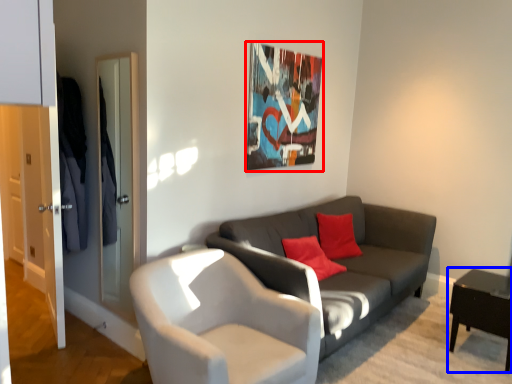
Question: Among these objects, which one is nearest to the camera, picture frame (highlighted by a red box) or table (highlighted by a blue box)?

Choices:
 (A) picture frame
 (B) table

Answer: (B)